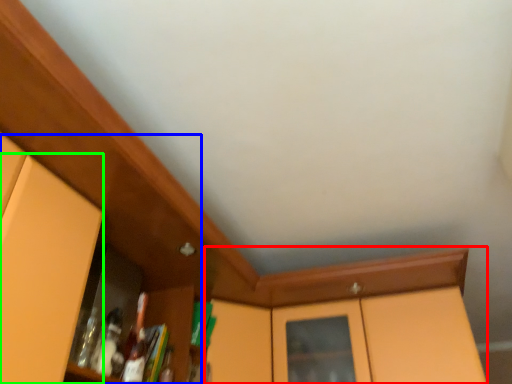
Question: Considering the real-world distances, which object is farthest from cabinetry (highlighted by a red box)? dresser (highlighted by a blue box) or door (highlighted by a green box)?

Choices:
 (A) dresser
 (B) door

Answer: (A)